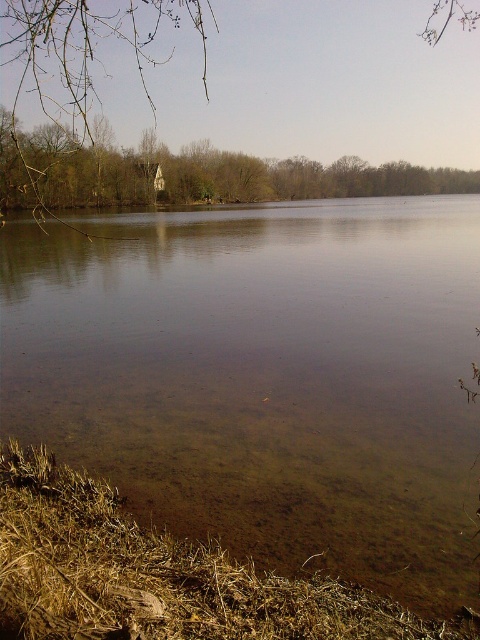
Is point (391, 189) positioned before point (39, 8)?

No.

Who is more distant from viewer, (164, 189) or (70, 58)?

The point (70, 58) is behind.

Identify the location of brown wood house at upper left. (216, 176).

Between brown sedimentary river at center and brown leafless branches at upper left, which one is positioned higher?

brown leafless branches at upper left is above.

Does brown sedimentary river at center appear over brown leafless branches at upper left?

Incorrect, brown sedimentary river at center is not positioned above brown leafless branches at upper left.

Does point (249, 417) lie in front of point (60, 116)?

Yes, it is in front of point (60, 116).

At what (x,y) coordinates should I click in order to perform the action: click on brown sedimentary river at center. Please return your answer as a coordinate pair (x, y). The height and width of the screenshot is (640, 480). Looking at the image, I should click on (264, 378).

Which is behind, point (154, 348) or point (2, 147)?

Positioned behind is point (2, 147).

Based on the photo, who is taller, brown sedimentary river at center or brown wood house at upper left?

With more height is brown wood house at upper left.

At what (x,y) coordinates should I click in order to perform the action: click on brown sedimentary river at center. Please return your answer as a coordinate pair (x, y). The height and width of the screenshot is (640, 480). Looking at the image, I should click on (264, 378).